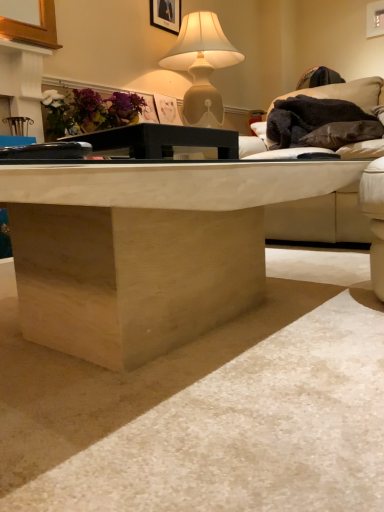
Question: Is natural wood coffee table at center positioned beyond the bounds of matte floral arrangement at upper left?

Choices:
 (A) no
 (B) yes

Answer: (B)

Question: Is natural wood coffee table at center bigger than matte floral arrangement at upper left?

Choices:
 (A) no
 (B) yes

Answer: (B)

Question: From a real-world perspective, does natural wood coffee table at center stand above matte floral arrangement at upper left?

Choices:
 (A) yes
 (B) no

Answer: (B)

Question: From the image's perspective, is natural wood coffee table at center located above matte floral arrangement at upper left?

Choices:
 (A) no
 (B) yes

Answer: (A)

Question: Is natural wood coffee table at center in front of matte floral arrangement at upper left?

Choices:
 (A) no
 (B) yes

Answer: (B)

Question: Can you confirm if natural wood coffee table at center is taller than matte floral arrangement at upper left?

Choices:
 (A) yes
 (B) no

Answer: (B)

Question: Is matte beige lamp at upper center wider than black matte table at center?

Choices:
 (A) no
 (B) yes

Answer: (B)

Question: Is matte beige lamp at upper center at the left side of black matte table at center?

Choices:
 (A) yes
 (B) no

Answer: (B)

Question: Could you tell me if matte beige lamp at upper center is turned towards black matte table at center?

Choices:
 (A) no
 (B) yes

Answer: (A)

Question: Can you confirm if matte beige lamp at upper center is smaller than black matte table at center?

Choices:
 (A) yes
 (B) no

Answer: (B)

Question: Does matte beige lamp at upper center have a lesser width compared to black matte table at center?

Choices:
 (A) yes
 (B) no

Answer: (B)

Question: Is matte beige lamp at upper center far from black matte table at center?

Choices:
 (A) no
 (B) yes

Answer: (B)

Question: Could you tell me if matte beige lamp at upper center is facing matte floral arrangement at upper left?

Choices:
 (A) yes
 (B) no

Answer: (B)